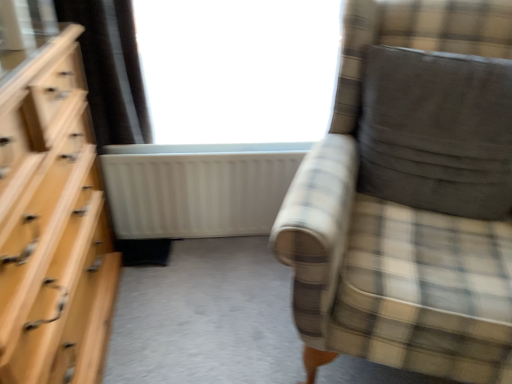
Question: Is transparent glass window at upper center facing towards light wood dresser at left?

Choices:
 (A) yes
 (B) no

Answer: (A)

Question: Is transparent glass window at upper center oriented away from light wood dresser at left?

Choices:
 (A) yes
 (B) no

Answer: (B)

Question: From a real-world perspective, is transparent glass window at upper center below light wood dresser at left?

Choices:
 (A) yes
 (B) no

Answer: (B)

Question: Would you say transparent glass window at upper center contains light wood dresser at left?

Choices:
 (A) yes
 (B) no

Answer: (B)

Question: Can you confirm if transparent glass window at upper center is thinner than light wood dresser at left?

Choices:
 (A) no
 (B) yes

Answer: (B)

Question: Does transparent glass window at upper center have a greater width compared to light wood dresser at left?

Choices:
 (A) yes
 (B) no

Answer: (B)

Question: From a real-world perspective, is white matte radiator at center physically below transparent glass window at upper center?

Choices:
 (A) yes
 (B) no

Answer: (A)

Question: From a real-world perspective, is white matte radiator at center over transparent glass window at upper center?

Choices:
 (A) yes
 (B) no

Answer: (B)

Question: From the image's perspective, is white matte radiator at center on top of transparent glass window at upper center?

Choices:
 (A) yes
 (B) no

Answer: (B)

Question: Could you tell me if white matte radiator at center is turned towards transparent glass window at upper center?

Choices:
 (A) yes
 (B) no

Answer: (B)

Question: Is the depth of white matte radiator at center less than that of transparent glass window at upper center?

Choices:
 (A) yes
 (B) no

Answer: (B)

Question: Is white matte radiator at center not inside transparent glass window at upper center?

Choices:
 (A) yes
 (B) no

Answer: (A)

Question: From a real-world perspective, is dark gray suede pillow at right below transparent glass window at upper center?

Choices:
 (A) yes
 (B) no

Answer: (A)